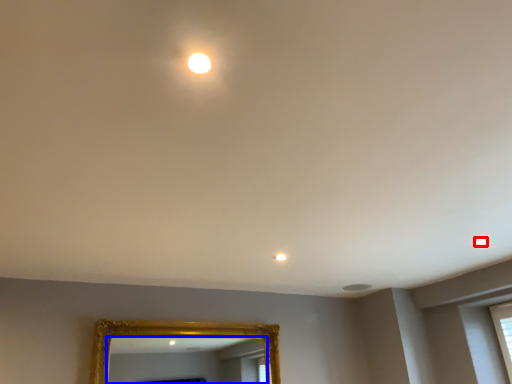
Question: Which object appears closest to the camera in this image, light (highlighted by a red box) or mirror (highlighted by a blue box)?

Choices:
 (A) light
 (B) mirror

Answer: (A)